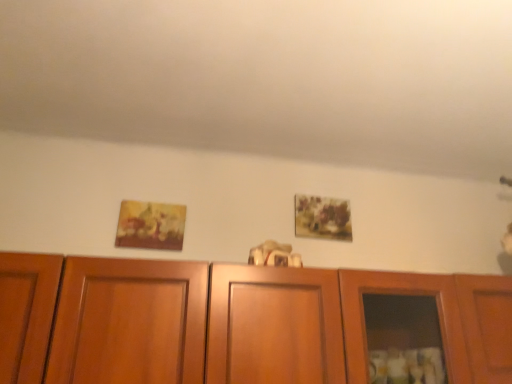
Question: Is matte yellow painting at left, positioned as the second picture frame in back-to-front order, located outside wooden cabinet at center?

Choices:
 (A) yes
 (B) no

Answer: (A)

Question: Is wooden cabinet at center surrounded by matte yellow painting at left, which is the first picture frame in left-to-right order?

Choices:
 (A) no
 (B) yes

Answer: (A)

Question: From the image's perspective, does matte yellow painting at left, positioned as the second picture frame in right-to-left order, appear lower than wooden cabinet at center?

Choices:
 (A) yes
 (B) no

Answer: (B)

Question: Is matte yellow painting at left, which is the first picture frame in left-to-right order, wider than wooden cabinet at center?

Choices:
 (A) yes
 (B) no

Answer: (B)

Question: Does matte yellow painting at left, positioned as the second picture frame in right-to-left order, lie in front of wooden cabinet at center?

Choices:
 (A) yes
 (B) no

Answer: (B)

Question: From the image's perspective, would you say wooden cabinet at center is positioned over matte yellow painting at left, positioned as the second picture frame in right-to-left order?

Choices:
 (A) yes
 (B) no

Answer: (B)

Question: Is the position of wooden cabinet at center less distant than that of matte yellow painting at left, placed as the 1th picture frame when sorted from front to back?

Choices:
 (A) no
 (B) yes

Answer: (B)

Question: Considering the relative sizes of wooden cabinet at center and matte yellow painting at left, placed as the 1th picture frame when sorted from front to back, in the image provided, is wooden cabinet at center shorter than matte yellow painting at left, placed as the 1th picture frame when sorted from front to back,?

Choices:
 (A) yes
 (B) no

Answer: (B)

Question: From the image's perspective, is wooden cabinet at center beneath matte yellow painting at left, positioned as the second picture frame in right-to-left order?

Choices:
 (A) no
 (B) yes

Answer: (B)

Question: Considering the relative sizes of wooden cabinet at center and matte yellow painting at left, which is the first picture frame in left-to-right order, in the image provided, is wooden cabinet at center taller than matte yellow painting at left, which is the first picture frame in left-to-right order,?

Choices:
 (A) yes
 (B) no

Answer: (A)

Question: Considering the relative positions of wooden cabinet at center and matte yellow painting at left, which is the first picture frame in left-to-right order, in the image provided, is wooden cabinet at center to the left of matte yellow painting at left, which is the first picture frame in left-to-right order, from the viewer's perspective?

Choices:
 (A) yes
 (B) no

Answer: (B)

Question: From the image's perspective, is matte floral painting at upper center, the 2th picture frame positioned from the front, below wooden cabinet at center?

Choices:
 (A) no
 (B) yes

Answer: (A)